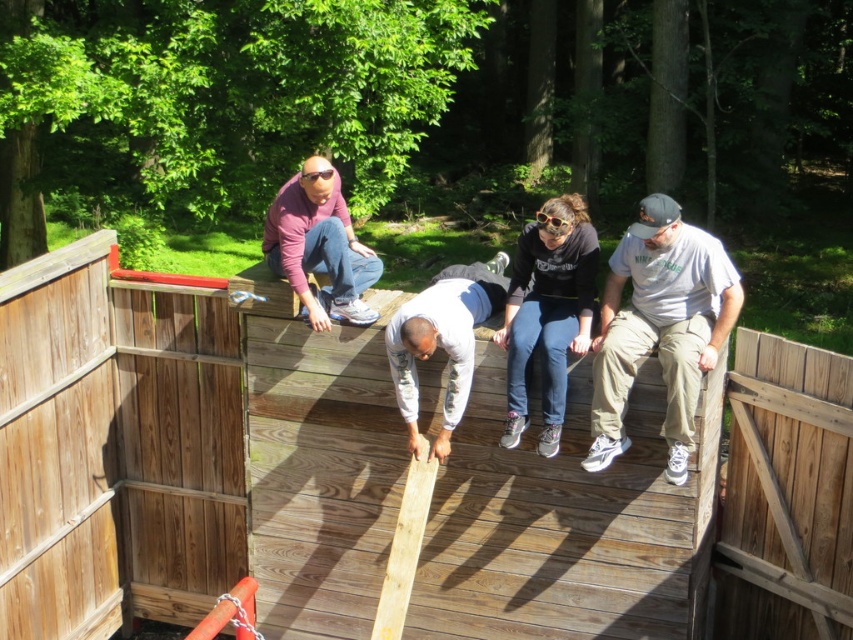
You are standing on the wooden deck at center and want to reach the matte black hoodie at center. Which direction should you move to get there?

The wooden deck at center is located below the matte black hoodie at center, so you should move upward to reach the matte black hoodie at center.